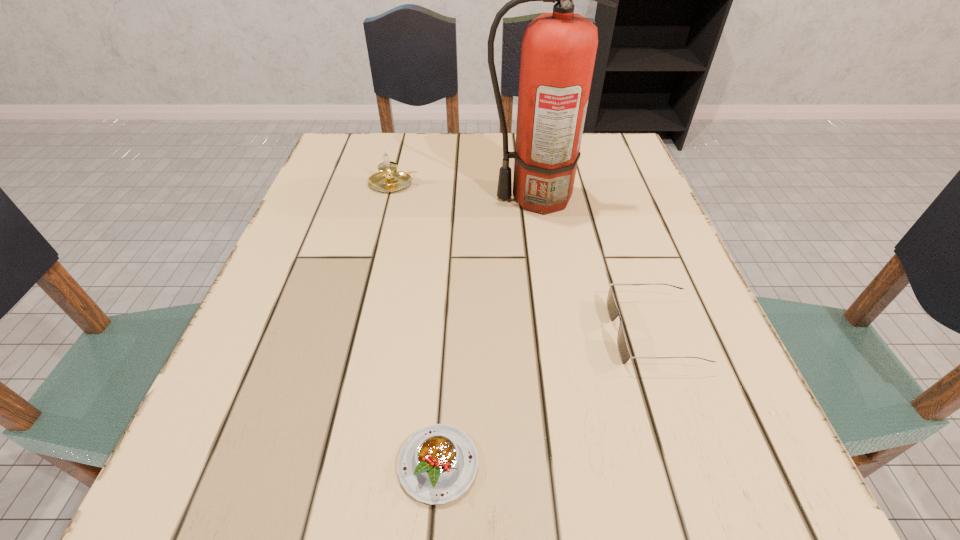
Identify the location of free space located on the front-facing side of the second nearest object. This screenshot has height=540, width=960. (466, 333).

What are the coordinates of `vacant space located 0.100m on the front-facing side of the second nearest object` in the screenshot? It's located at (552, 333).

Find the location of `blank space located on the front-facing side of the second nearest object`. blank space located on the front-facing side of the second nearest object is located at coordinates (435, 333).

This screenshot has height=540, width=960. Find the location of `vacant region located on the back of the second object from left to right`. vacant region located on the back of the second object from left to right is located at coordinates (447, 324).

I want to click on fire extinguisher that is at the far edge, so (558, 50).

Find the location of a particular element. This screenshot has width=960, height=540. candle holder that is at the far edge is located at coordinates (386, 180).

Where is `object located at the near edge`? This screenshot has width=960, height=540. object located at the near edge is located at coordinates (437, 464).

The image size is (960, 540). What are the coordinates of `object positioned at the left edge` in the screenshot? It's located at (386, 180).

Locate an element on the screen. Image resolution: width=960 pixels, height=540 pixels. fire extinguisher at the right edge is located at coordinates (558, 50).

In order to click on sunglasses at the right edge in this screenshot , I will do `click(613, 312)`.